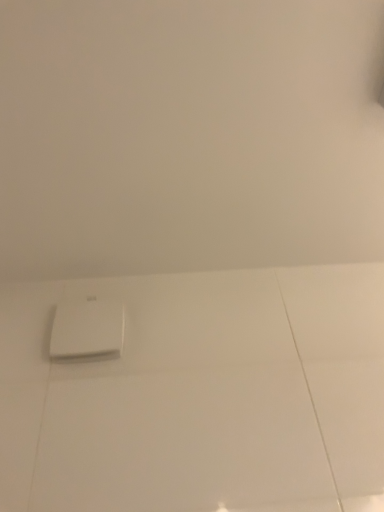
Locate an element on the screen. vacant point above white matte wall at upper center (from a real-world perspective) is located at coordinates (193, 169).